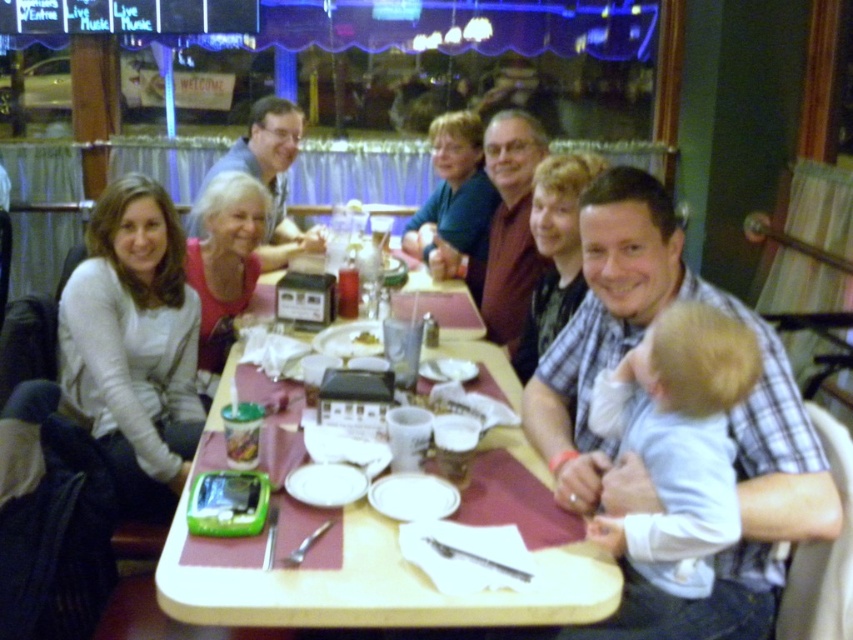
You are a server in a restaurant and need to place a 12 inch tall cake on the table. The cake needs to be placed on the white soft sweater at left or the wooden table at center. Which surface can accommodate the cake without it touching the floor?

The white soft sweater at left has a greater height compared to wooden table at center, so placing the cake on the white soft sweater at left would allow it to stand without touching the floor since it is taller.

You are a photographer taking a group photo of the people at the rectangular table. You want to ensure that the plaid shirt at center and the white soft sweater at left are both visible in the photo. Which clothing item should you focus on first to frame the shot properly?

The plaid shirt at center is shorter than the white soft sweater at left, so you should focus on the white soft sweater at left first to ensure it fits within the frame.